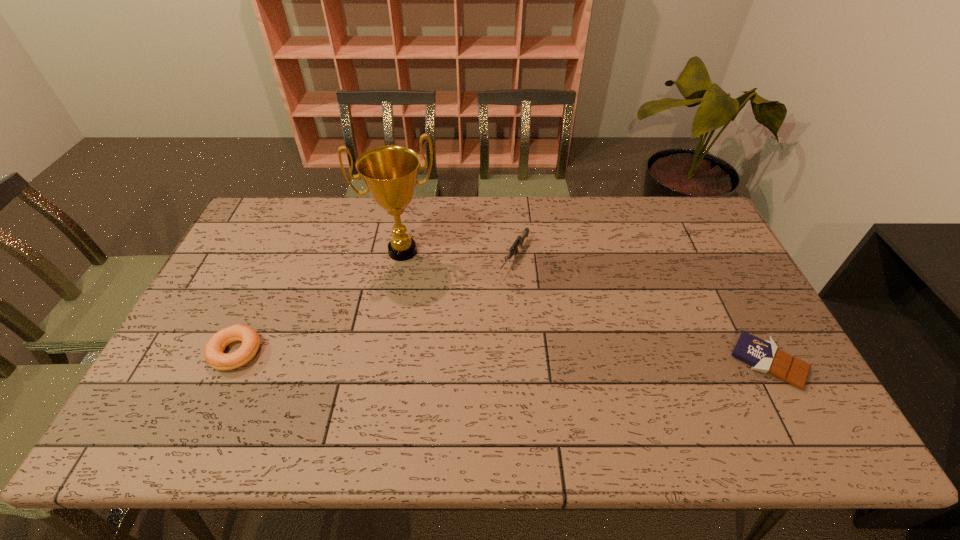
Find the location of a particular element. the leftmost object is located at coordinates (214, 348).

Find the location of a particular element. Image resolution: width=960 pixels, height=540 pixels. the third tallest object is located at coordinates (214, 348).

This screenshot has width=960, height=540. In order to click on chocolate bar in this screenshot , I will do `click(762, 355)`.

Identify the location of the rightmost object. The height and width of the screenshot is (540, 960). click(762, 355).

Find the location of a particular element. This screenshot has width=960, height=540. the third object from left to right is located at coordinates (519, 241).

Where is `the second tallest object`? This screenshot has width=960, height=540. the second tallest object is located at coordinates (519, 241).

This screenshot has height=540, width=960. What are the coordinates of `award` in the screenshot? It's located at (390, 173).

Identify the location of the tallest object. The height and width of the screenshot is (540, 960). (390, 173).

You are a GUI agent. You are given a task and a screenshot of the screen. Output one action in this format:
    pyautogui.click(x=<x>, y=<y>)
    Task: Click on the vacant region located on the left of the third tallest object
    The image size is (960, 540).
    Given the screenshot: What is the action you would take?
    pyautogui.click(x=176, y=352)

You are a GUI agent. You are given a task and a screenshot of the screen. Output one action in this format:
    pyautogui.click(x=<x>, y=<y>)
    Task: Click on the vacant area situated on the left of the shortest object
    The height and width of the screenshot is (540, 960).
    Given the screenshot: What is the action you would take?
    point(706,362)